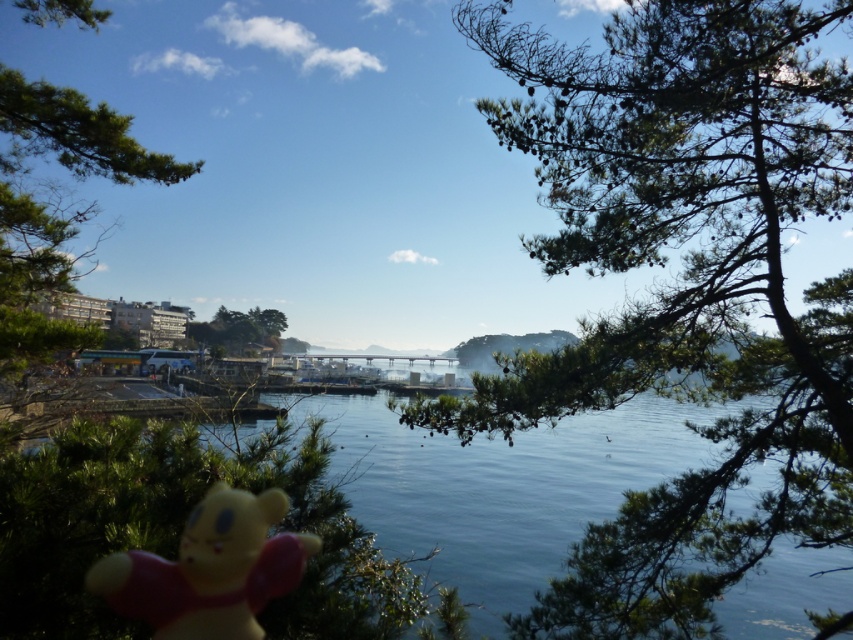
You are a photographer wanting to capture the yellow matte plush bear at lower left and the green matte tree at center in the same frame. Since the bear is closer to you, how does its position compare to the tree?

The yellow matte plush bear at lower left is located below the green matte tree at center, so it appears lower in the frame.

You are a tourist visiting the coastal town and spot the yellow matte plush bear at lower left and the green matte tree at center. Which object is positioned to the right of the other?

The yellow matte plush bear at lower left is to the right of the green matte tree at center.